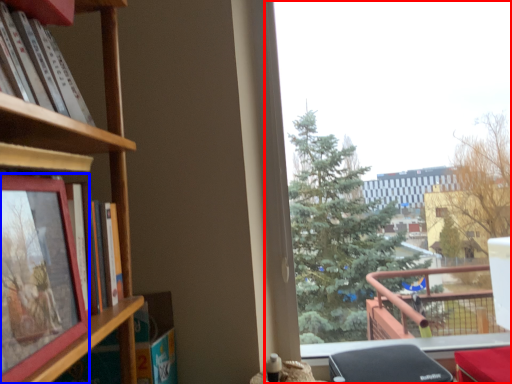
Question: Which object is closer to the camera taking this photo, window (highlighted by a red box) or picture frame (highlighted by a blue box)?

Choices:
 (A) window
 (B) picture frame

Answer: (B)